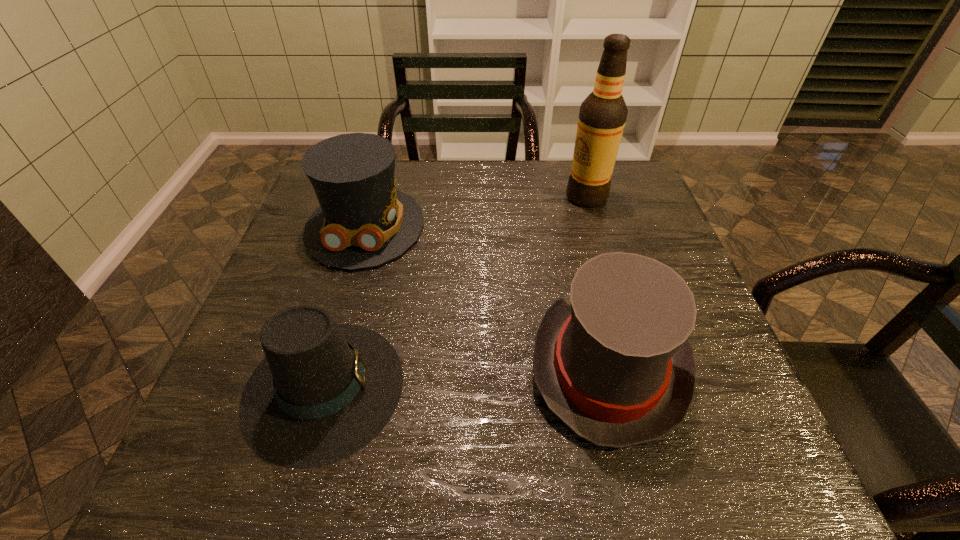
This screenshot has width=960, height=540. Find the location of `alcohol that is at the right edge`. alcohol that is at the right edge is located at coordinates (602, 117).

Identify the location of dress hat that is at the right edge. (612, 361).

Find the location of a particular element. The width and height of the screenshot is (960, 540). object that is positioned at the far left corner is located at coordinates (363, 221).

Where is `object at the near left corner`? object at the near left corner is located at coordinates (324, 391).

Identify the location of object that is positioned at the far right corner. (602, 117).

Where is `object that is at the near right corner`? object that is at the near right corner is located at coordinates (612, 361).

The width and height of the screenshot is (960, 540). In the image, there is a desktop. Identify the location of vacant space at the far edge. (513, 199).

In order to click on vacant space at the near edge in this screenshot , I will do `click(385, 467)`.

The height and width of the screenshot is (540, 960). In the image, there is a desktop. What are the coordinates of `vacant space at the left edge` in the screenshot? It's located at (296, 287).

The height and width of the screenshot is (540, 960). I want to click on vacant space at the right edge of the desktop, so click(749, 401).